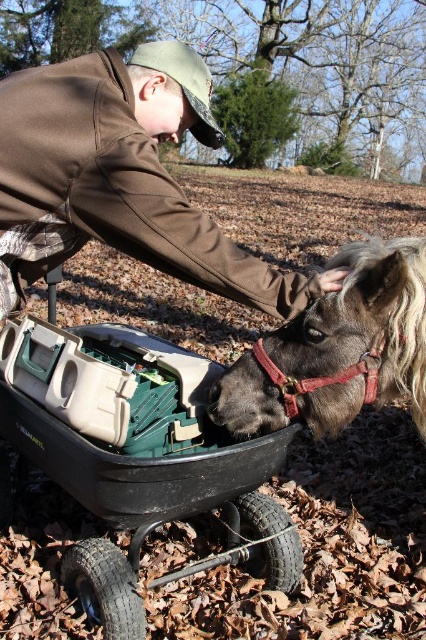
Is brown soft jacket at center smaller than dark brown leather horse at center?

Incorrect, brown soft jacket at center is not smaller in size than dark brown leather horse at center.

Is brown soft jacket at center in front of dark brown leather horse at center?

No.

Does point (112, 148) lie behind point (399, 237)?

No, (112, 148) is in front of (399, 237).

What are the coordinates of `brown soft jacket at center` in the screenshot? It's located at (120, 177).

Between black plastic wagon at lower center and dark brown leather horse at center, which one is positioned higher?

dark brown leather horse at center

Between point (298, 563) and point (414, 344), which one is positioned behind?

Positioned behind is point (298, 563).

The height and width of the screenshot is (640, 426). In order to click on black plastic wagon at lower center in this screenshot , I will do `click(138, 456)`.

Is black plastic wagon at lower center to the right of brown soft jacket at center from the viewer's perspective?

No, black plastic wagon at lower center is not to the right of brown soft jacket at center.

Is black plastic wagon at lower center shorter than brown soft jacket at center?

In fact, black plastic wagon at lower center may be taller than brown soft jacket at center.

Locate an element on the screen. black plastic wagon at lower center is located at coordinates (138, 456).

Find the location of a particular element. This screenshot has width=426, height=640. black plastic wagon at lower center is located at coordinates (138, 456).